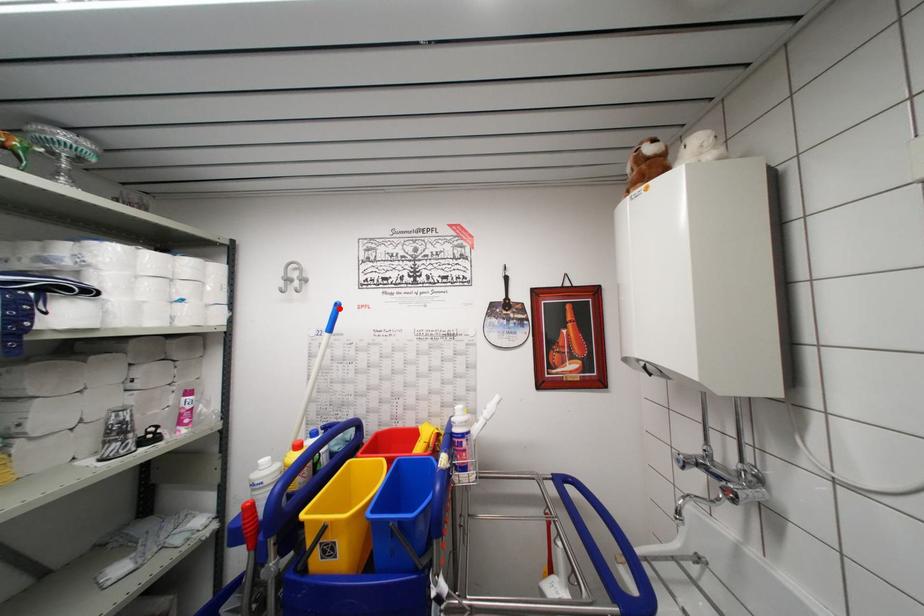
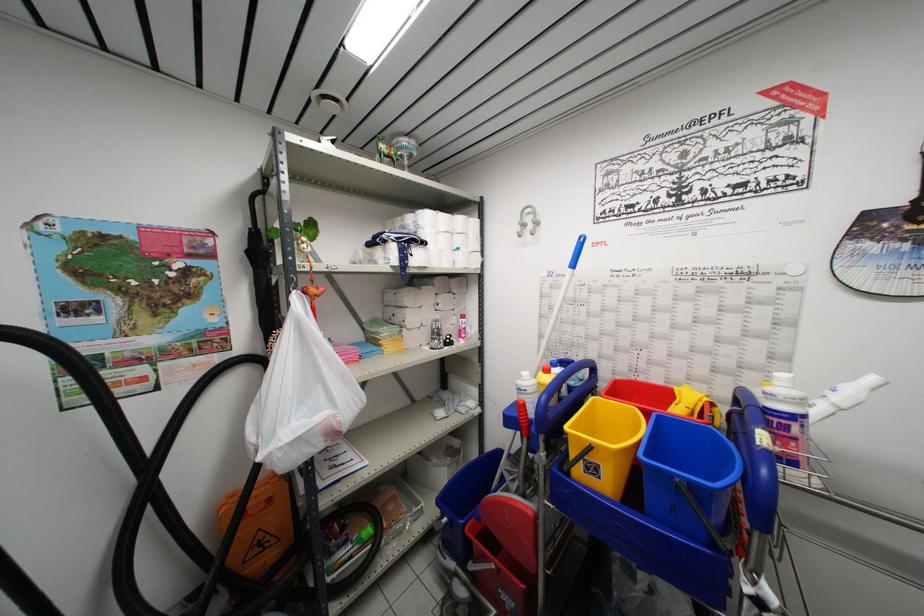
Where in the second image is the point corresponding to the highlighted location from the first image?

(584, 241)